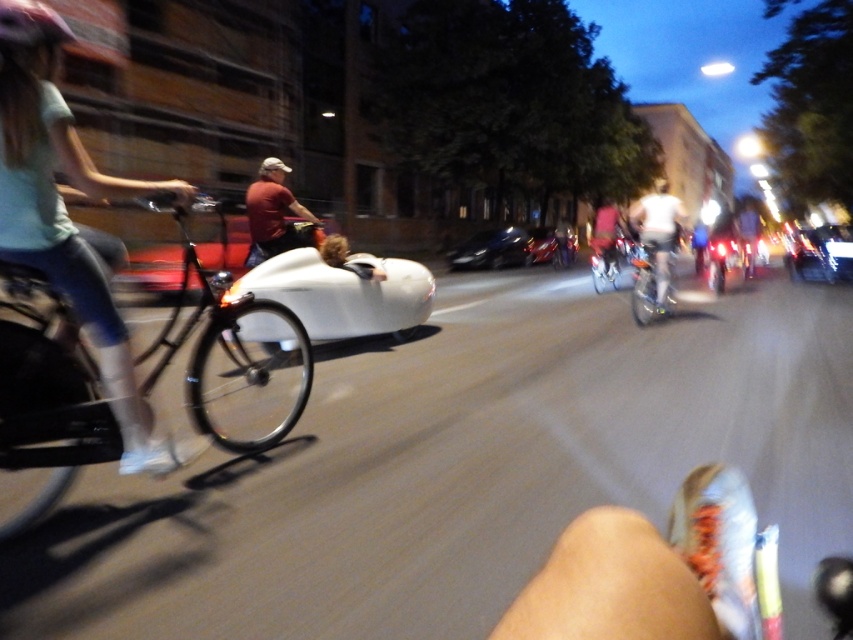
Question: Which point is closer to the camera?

Choices:
 (A) (648, 296)
 (B) (35, 253)
 (C) (637, 289)

Answer: (B)

Question: Observing the image, what is the correct spatial positioning of white matte bicycle at center in reference to matte red shirt at center?

Choices:
 (A) right
 (B) left

Answer: (A)

Question: Is black matte bicycle at left positioned in front of shiny silver bicycle at center?

Choices:
 (A) no
 (B) yes

Answer: (B)

Question: Which of the following is the farthest from the observer?

Choices:
 (A) black matte bicycle at left
 (B) metallic silver bicycle at center
 (C) matte red shirt at center
 (D) matte teal shirt at left

Answer: (B)

Question: Does white matte bicycle at center have a larger size compared to metallic silver bicycle at center?

Choices:
 (A) no
 (B) yes

Answer: (B)

Question: Which of the following is the closest to the observer?

Choices:
 (A) (80, 256)
 (B) (274, 196)

Answer: (A)